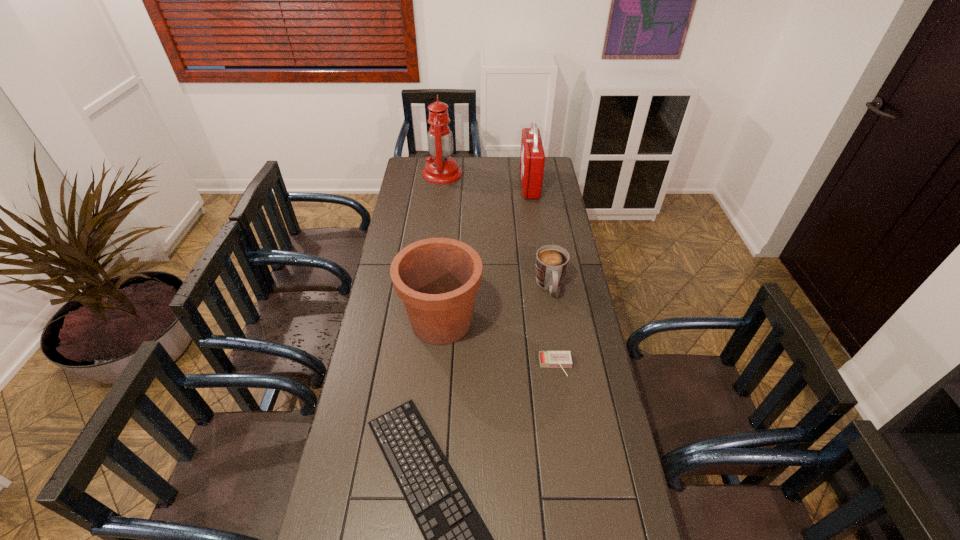
The width and height of the screenshot is (960, 540). I want to click on object that is at the far right corner, so click(532, 158).

In the image, there is a desktop. Where is `free space at the far edge`? Image resolution: width=960 pixels, height=540 pixels. free space at the far edge is located at coordinates (513, 172).

Identify the location of vacant region at the left edge of the desktop. (399, 217).

You are a GUI agent. You are given a task and a screenshot of the screen. Output one action in this format:
    pyautogui.click(x=<x>, y=<y>)
    Task: Click on the free location at the right edge of the desktop
    This screenshot has height=540, width=960.
    Given the screenshot: What is the action you would take?
    pyautogui.click(x=557, y=351)

Locate an element on the screen. The image size is (960, 540). blank area at the far right corner is located at coordinates (553, 179).

Find the location of a particular element. The image size is (960, 540). vacant space that is in between the fourth shortest object and the third shortest object is located at coordinates (495, 303).

Where is `free space that is in between the first-aid kit and the oil lamp`? The image size is (960, 540). free space that is in between the first-aid kit and the oil lamp is located at coordinates (486, 179).

Find the location of a particular element. vacant space that is in between the tallest object and the fifth tallest object is located at coordinates (499, 269).

Locate an element on the screen. This screenshot has height=540, width=960. free spot between the mug and the matchbox is located at coordinates (553, 326).

Where is `free spot between the fourth shortest object and the matchbox`? The height and width of the screenshot is (540, 960). free spot between the fourth shortest object and the matchbox is located at coordinates (498, 343).